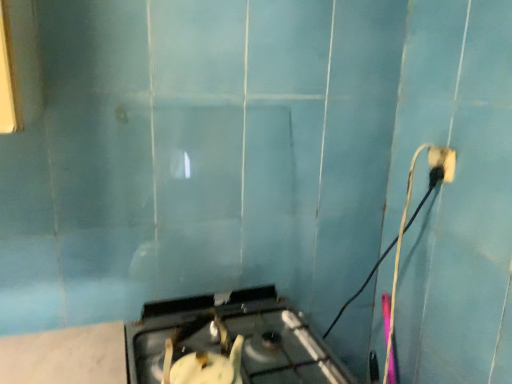
Question: Considering their positions, is metallic silver gas stove at center located in front of or behind black plastic power plug at upper right?

Choices:
 (A) front
 (B) behind

Answer: (A)

Question: In terms of size, does metallic silver gas stove at center appear bigger or smaller than black plastic power plug at upper right?

Choices:
 (A) small
 (B) big

Answer: (B)

Question: Is metallic silver gas stove at center taller or shorter than black plastic power plug at upper right?

Choices:
 (A) short
 (B) tall

Answer: (B)

Question: Considering their positions, is black plastic power plug at upper right located in front of or behind metallic silver gas stove at center?

Choices:
 (A) front
 (B) behind

Answer: (B)

Question: Is black plastic power plug at upper right inside the boundaries of metallic silver gas stove at center, or outside?

Choices:
 (A) outside
 (B) inside

Answer: (A)

Question: In terms of size, does black plastic power plug at upper right appear bigger or smaller than metallic silver gas stove at center?

Choices:
 (A) big
 (B) small

Answer: (B)

Question: Visually, is black plastic power plug at upper right positioned to the left or to the right of metallic silver gas stove at center?

Choices:
 (A) right
 (B) left

Answer: (A)